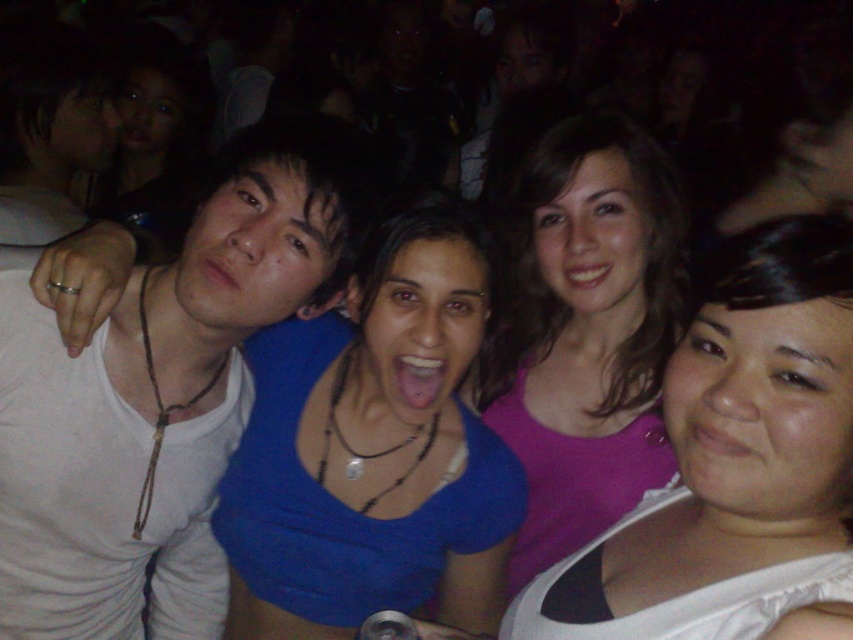
Can you confirm if white matte tank top at left is smaller than purple matte tank top at center?

No, white matte tank top at left is not smaller than purple matte tank top at center.

Who is positioned more to the right, white matte tank top at left or purple matte tank top at center?

From the viewer's perspective, purple matte tank top at center appears more on the right side.

Which is in front, point (28, 532) or point (637, 269)?

Point (28, 532)

Identify the location of white matte tank top at left. The image size is (853, 640). (160, 397).

Between blue fabric top at center and purple matte tank top at center, which one is positioned higher?

purple matte tank top at center

Does blue fabric top at center have a greater height compared to purple matte tank top at center?

No.

Which is behind, point (369, 417) or point (515, 544)?

The point (515, 544) is more distant.

I want to click on blue fabric top at center, so click(372, 452).

Does point (289, 445) lie behind point (718, 328)?

That is True.

Can you confirm if blue fabric top at center is thinner than pink matte tank top at center?

Incorrect, blue fabric top at center's width is not less than pink matte tank top at center's.

Measure the distance between blue fabric top at center and camera.

blue fabric top at center and camera are 3.35 feet apart.

Find the location of `blue fabric top at center`. blue fabric top at center is located at coordinates (372, 452).